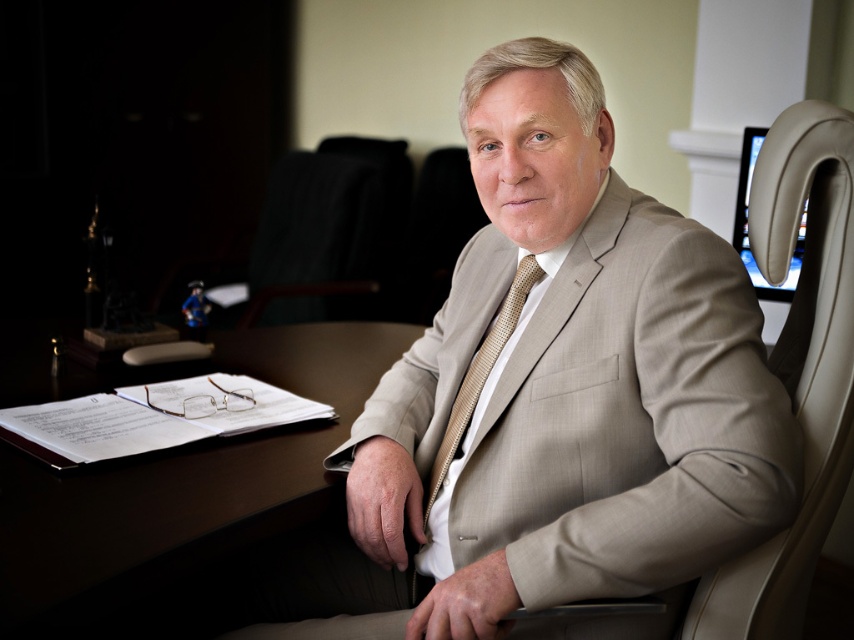
From the picture: Between beige leather swivel chair at right and beige leather monitor at upper right, which one is positioned lower?

beige leather swivel chair at right

This screenshot has width=854, height=640. Describe the element at coordinates (797, 365) in the screenshot. I see `beige leather swivel chair at right` at that location.

Is point (793, 326) more distant than point (749, 140)?

No, it is not.

The height and width of the screenshot is (640, 854). Find the location of `beige leather swivel chair at right`. beige leather swivel chair at right is located at coordinates (797, 365).

Which is above, gold textured tie at center or beige leather monitor at upper right?

beige leather monitor at upper right is higher up.

Based on the photo, between gold textured tie at center and beige leather monitor at upper right, which one appears on the left side from the viewer's perspective?

gold textured tie at center is more to the left.

Which is behind, point (461, 408) or point (793, 291)?

Point (793, 291)

Where is `gold textured tie at center`? The width and height of the screenshot is (854, 640). gold textured tie at center is located at coordinates (478, 376).

Is beige textured suit at center bigger than beige leather monitor at upper right?

Correct, beige textured suit at center is larger in size than beige leather monitor at upper right.

Is beige textured suit at center positioned behind beige leather monitor at upper right?

That is False.

Which is in front, point (588, 496) or point (746, 189)?

Point (588, 496) is in front.

The width and height of the screenshot is (854, 640). What are the coordinates of `beige textured suit at center` in the screenshot? It's located at pos(554,400).